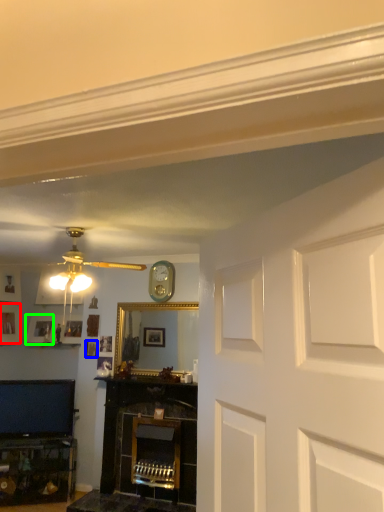
Question: Considering the real-world distances, which object is closest to picture frame (highlighted by a red box)? picture frame (highlighted by a blue box) or picture frame (highlighted by a green box).

Choices:
 (A) picture frame
 (B) picture frame

Answer: (B)